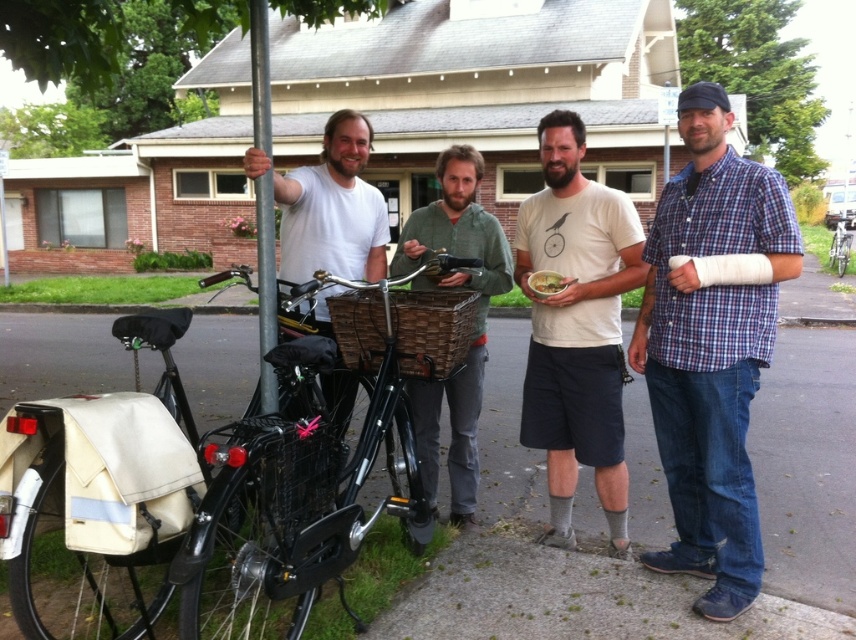
Which object is wider, the blue plaid shirt at right or the woven brown basket at center?

The woven brown basket at center is wider than the blue plaid shirt at right.